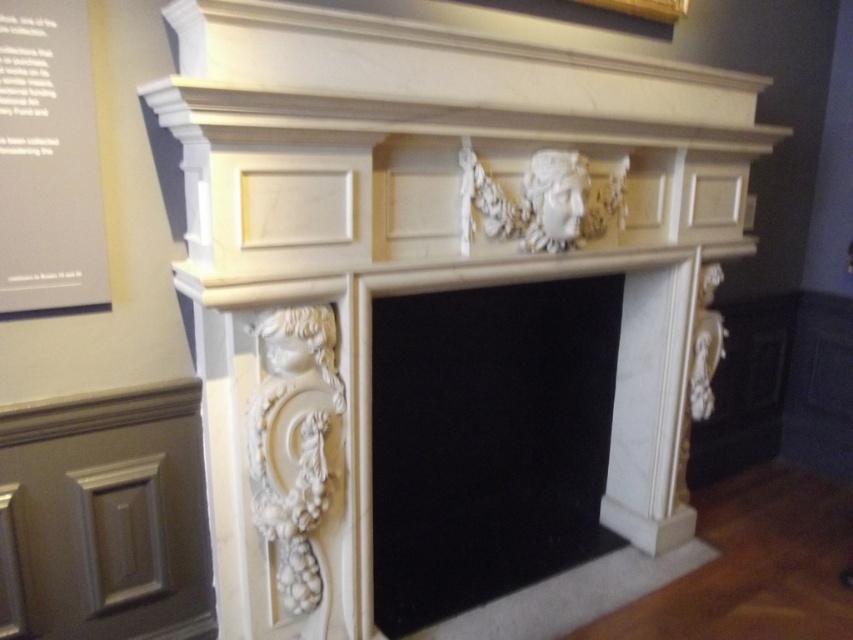
Is point (78, 196) positioned behind point (619, 8)?

No, it is in front of (619, 8).

Is point (68, 195) less distant than point (659, 19)?

Yes, it is in front of point (659, 19).

The width and height of the screenshot is (853, 640). What do you see at coordinates (48, 161) in the screenshot? I see `white paper at upper left` at bounding box center [48, 161].

Locate an element on the screen. Image resolution: width=853 pixels, height=640 pixels. white paper at upper left is located at coordinates (48, 161).

Describe the element at coordinates (506, 435) in the screenshot. I see `white marble fireplace at center` at that location.

The height and width of the screenshot is (640, 853). Find the location of `white marble fireplace at center`. white marble fireplace at center is located at coordinates (506, 435).

Between white marble fireplace at center and wooden picture frame at upper center, which one is positioned higher?

wooden picture frame at upper center is higher up.

Is point (653, 326) farther from viewer compared to point (656, 20)?

That is True.

Where is `white marble fireplace at center`? The image size is (853, 640). white marble fireplace at center is located at coordinates (506, 435).